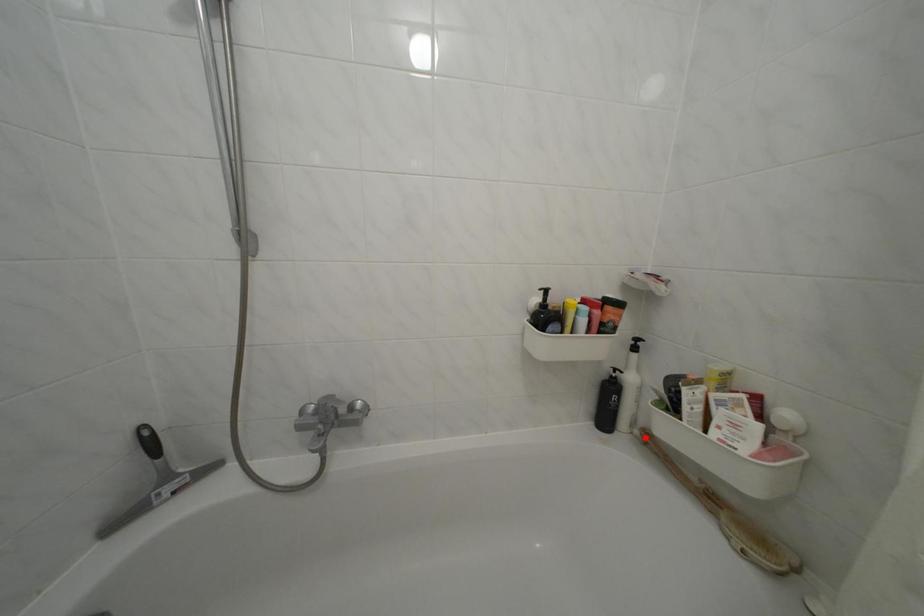
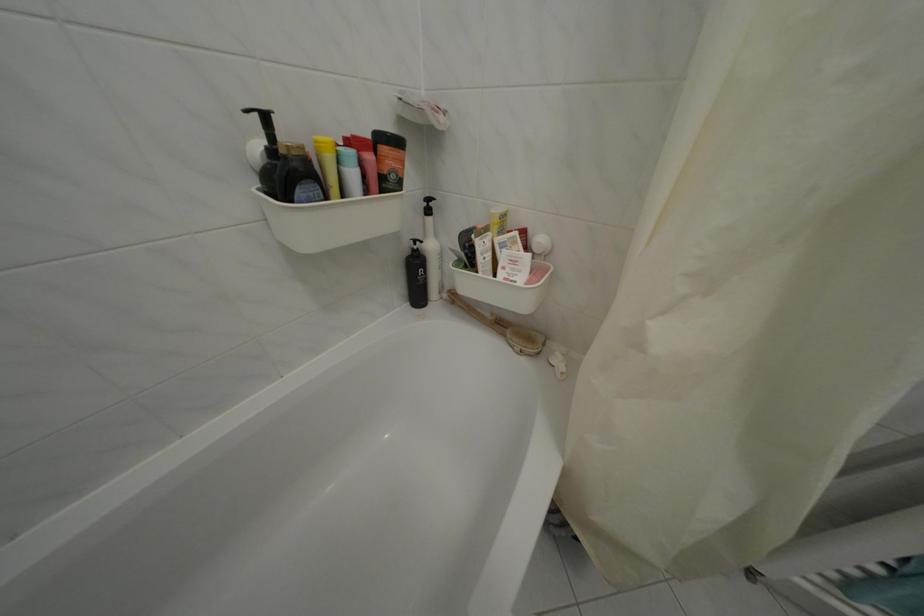
The point at the highlighted location is marked in the first image. Where is the corresponding point in the second image?

(454, 302)